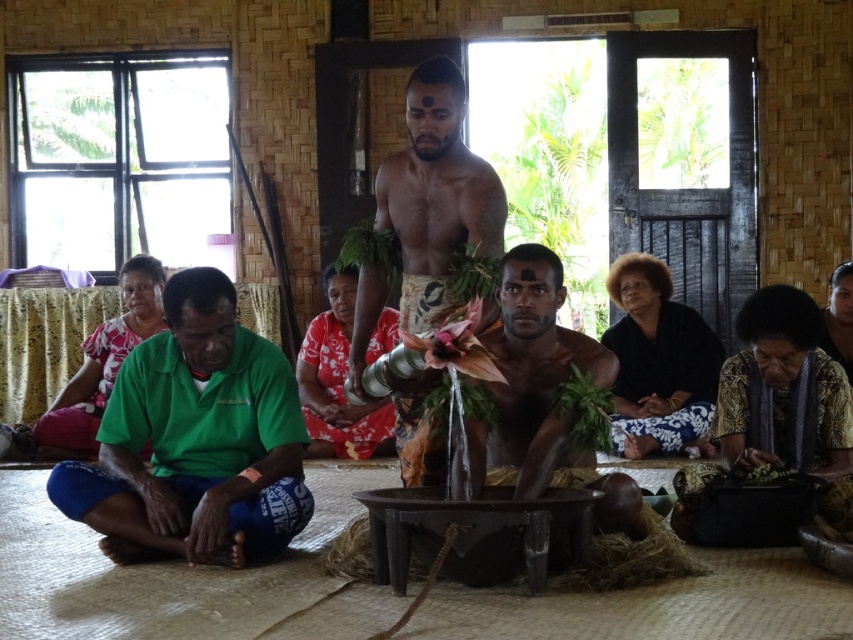
You are an anthropologist observing the scene. You notice the smooth wooden bowl at center and the matte green shirt at lower left. Which object is positioned higher in the image?

The smooth wooden bowl at center is located above the matte green shirt at lower left, so it is positioned higher in the image.